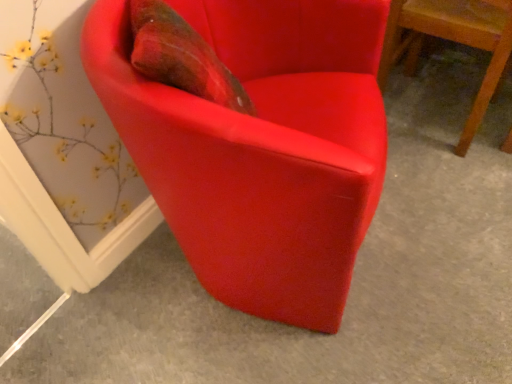
Question: Is satin red armchair at center, positioned as the second chair in right-to-left order, spatially inside satin red armchair at lower right, acting as the first chair starting from the right, or outside of it?

Choices:
 (A) inside
 (B) outside

Answer: (B)

Question: Considering the positions of satin red armchair at center, which ranks as the 1th chair in left-to-right order, and satin red armchair at lower right, acting as the first chair starting from the right, in the image, is satin red armchair at center, which ranks as the 1th chair in left-to-right order, wider or thinner than satin red armchair at lower right, acting as the first chair starting from the right,?

Choices:
 (A) thin
 (B) wide

Answer: (B)

Question: In terms of height, does satin red armchair at center, positioned as the second chair in right-to-left order, look taller or shorter compared to satin red armchair at lower right, acting as the 2th chair starting from the left?

Choices:
 (A) tall
 (B) short

Answer: (A)

Question: Based on their positions, is satin red armchair at lower right, acting as the first chair starting from the right, located to the left or right of satin red armchair at center, which ranks as the 1th chair in left-to-right order?

Choices:
 (A) left
 (B) right

Answer: (B)

Question: From the image's perspective, is satin red armchair at lower right, acting as the first chair starting from the right, above or below satin red armchair at center, which ranks as the 1th chair in left-to-right order?

Choices:
 (A) above
 (B) below

Answer: (A)

Question: In the image, is satin red armchair at lower right, acting as the 2th chair starting from the left, positioned in front of or behind satin red armchair at center, positioned as the second chair in right-to-left order?

Choices:
 (A) front
 (B) behind

Answer: (B)

Question: Is point (506, 64) positioned closer to the camera than point (314, 203)?

Choices:
 (A) farther
 (B) closer

Answer: (A)